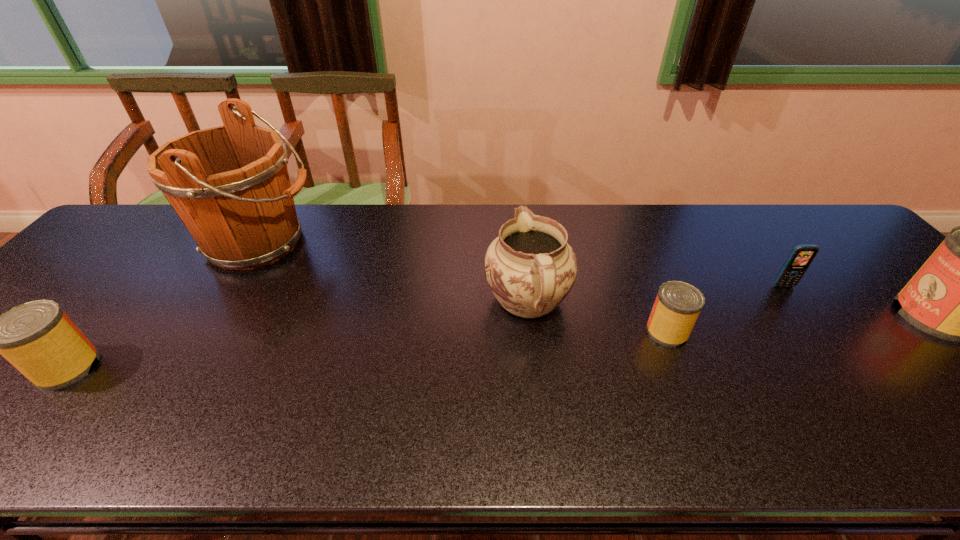
If we want them evenly spaced by inserting an extra can among them, please locate a free spot for this new can. Please provide its 2D coordinates. Your answer should be formatted as a tuple, i.e. [(x, y)], where the tuple contains the x and y coordinates of a point satisfying the conditions above.

[(378, 349)]